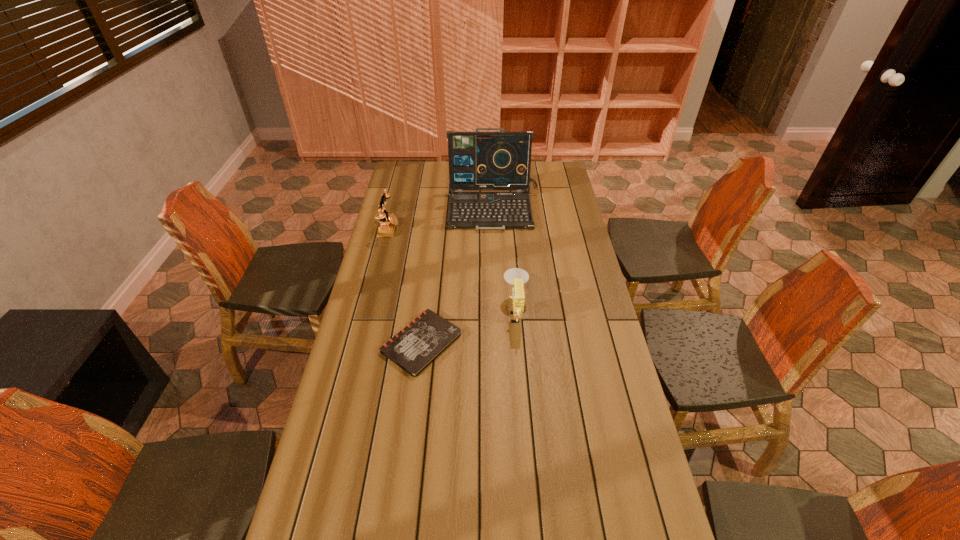
What are the coordinates of `blank area in the image that satisfies the following two spatial constraints: 1. on the dial of the telephone; 2. on the back side of the shortest object` in the screenshot? It's located at (360, 342).

I want to click on free point that satisfies the following two spatial constraints: 1. on the front-facing side of the tallest object; 2. on the dial of the telephone, so click(x=494, y=228).

Locate an element on the screen. The image size is (960, 540). vacant point that satisfies the following two spatial constraints: 1. on the dial of the notebook; 2. on the right side of the leftmost object is located at coordinates (360, 342).

Where is `vacant area in the image that satisfies the following two spatial constraints: 1. on the dial of the leftmost object; 2. on the back side of the notebook`? The image size is (960, 540). vacant area in the image that satisfies the following two spatial constraints: 1. on the dial of the leftmost object; 2. on the back side of the notebook is located at coordinates (360, 342).